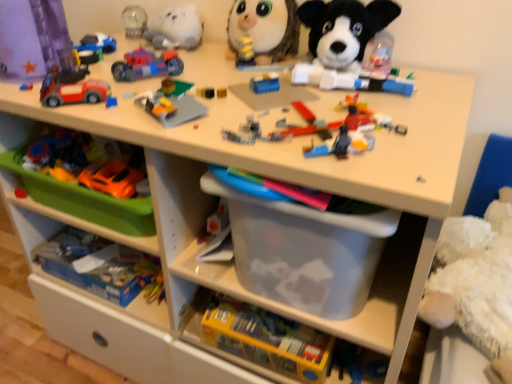
Identify the location of free space in front of soft plush dog at upper center, which is the 3th toy in top-to-bottom order. The image size is (512, 384). (390, 104).